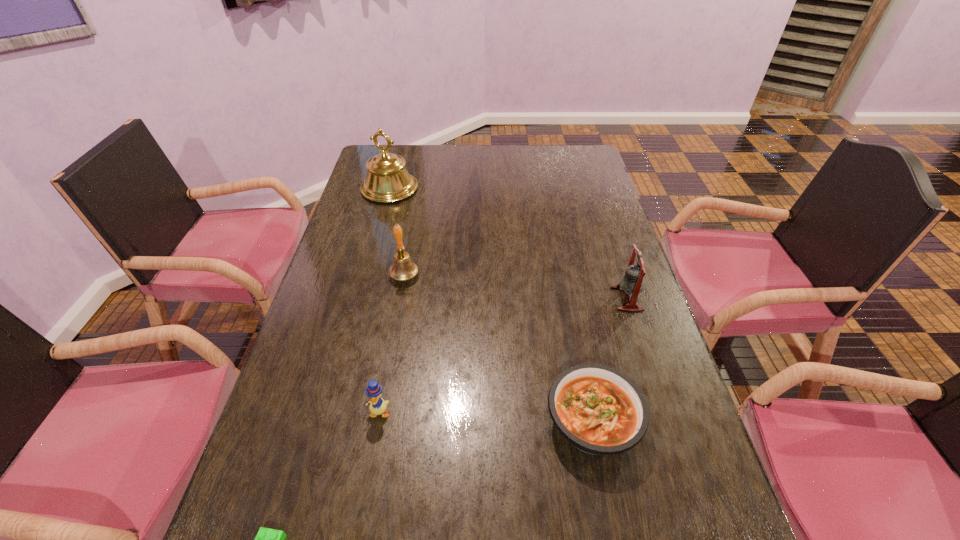
The width and height of the screenshot is (960, 540). Identify the location of vacant area between the duckling and the fifth tallest object. (486, 417).

I want to click on free space between the farthest bell and the duckling, so tap(384, 300).

Identify which object is the fifth closest to the duckling. Please provide its 2D coordinates. Your answer should be formatted as a tuple, i.e. [(x, y)], where the tuple contains the x and y coordinates of a point satisfying the conditions above.

[(387, 180)]

Locate an element on the screen. the closest object relative to the second object from right to left is located at coordinates (632, 283).

Select which bell is the closest to the shortest object. Please provide its 2D coordinates. Your answer should be formatted as a tuple, i.e. [(x, y)], where the tuple contains the x and y coordinates of a point satisfying the conditions above.

[(403, 268)]

Locate an element on the screen. This screenshot has width=960, height=540. the second closest bell to the duckling is located at coordinates pos(632,283).

Where is `vacant area that satisfies the following two spatial constraints: 1. on the back side of the stew; 2. on the right side of the rightmost bell`? This screenshot has height=540, width=960. vacant area that satisfies the following two spatial constraints: 1. on the back side of the stew; 2. on the right side of the rightmost bell is located at coordinates (568, 299).

Find the location of a particular element. vacant area in the image that satisfies the following two spatial constraints: 1. on the front side of the tallest bell; 2. on the left side of the fifth tallest object is located at coordinates (327, 422).